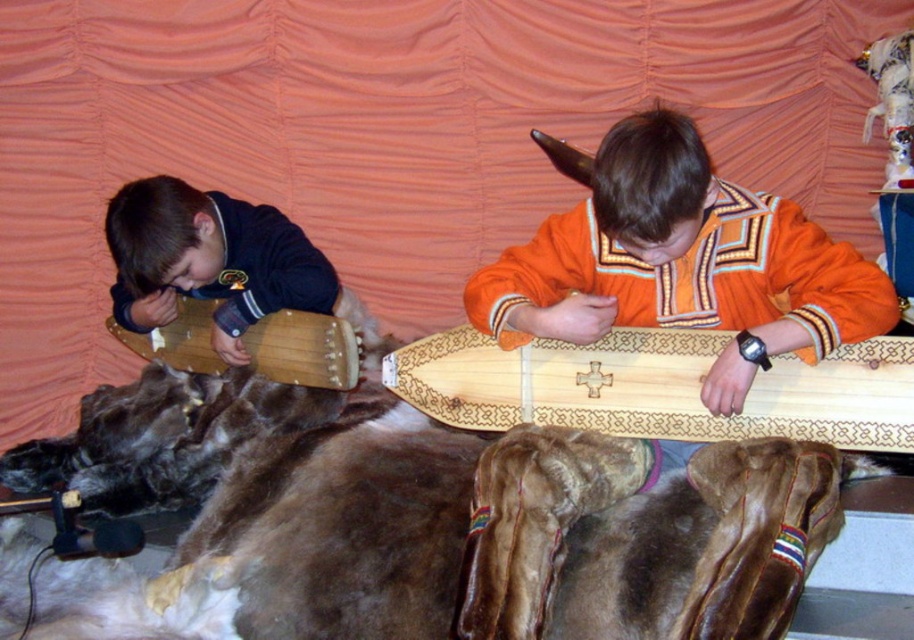
Question: Considering the real-world distances, which object is farthest from the natural wood longboard at center?

Choices:
 (A) wooden drum at left
 (B) orange fabric shirt at center

Answer: (A)

Question: Which point is closer to the camera?

Choices:
 (A) (277, 342)
 (B) (319, 260)
 (C) (729, 188)
 (D) (564, 404)

Answer: (C)

Question: Is natural wood longboard at center bigger than wooden drum at left?

Choices:
 (A) yes
 (B) no

Answer: (A)

Question: Does matte black sweater at left have a lesser width compared to wooden drum at left?

Choices:
 (A) yes
 (B) no

Answer: (A)

Question: From the image, what is the correct spatial relationship of orange fabric shirt at center in relation to natural wood longboard at center?

Choices:
 (A) right
 (B) left

Answer: (A)

Question: Which point is closer to the camera?

Choices:
 (A) (285, 216)
 (B) (835, 372)
 (C) (194, 323)
 (D) (693, 305)

Answer: (B)